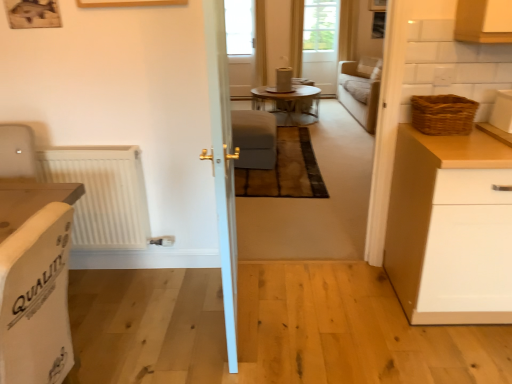
Find the location of a particular element. This screenshot has height=384, width=512. free space that is to the left of white glossy door at center is located at coordinates (151, 313).